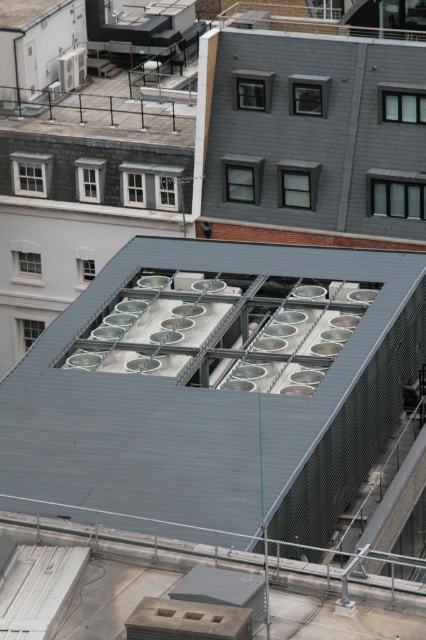
How much distance is there between metallic gray roof at center and gray matte roof at upper center?

metallic gray roof at center and gray matte roof at upper center are 12.64 meters apart.

Between point (218, 448) and point (331, 225), which one is positioned behind?

The point (331, 225) is more distant.

Between point (85, 314) and point (345, 220), which one is positioned in front?

Point (85, 314)

Locate an element on the screen. metallic gray roof at center is located at coordinates (215, 392).